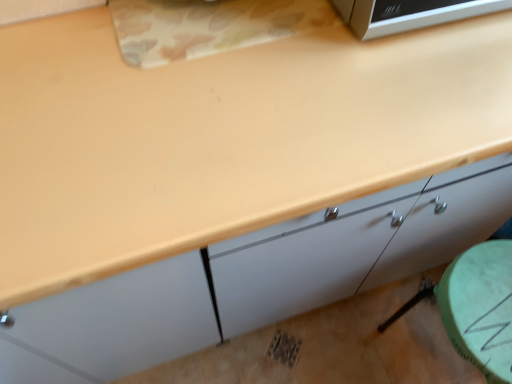
Where is `free space above white glossy cabinet at center (from a real-world perspective)`? free space above white glossy cabinet at center (from a real-world perspective) is located at coordinates (208, 92).